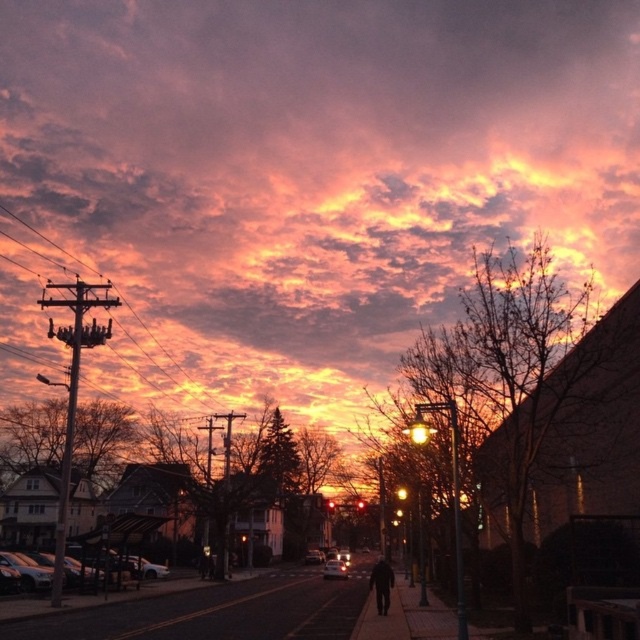
Can you confirm if dark asphalt road at lower center is smaller than shiny silver car at lower left?

Actually, dark asphalt road at lower center might be larger than shiny silver car at lower left.

Is point (205, 602) positioned in front of point (128, 570)?

Yes, it is in front of point (128, 570).

I want to click on dark asphalt road at lower center, so click(x=218, y=612).

Locate an element on the screen. dark asphalt road at lower center is located at coordinates (218, 612).

Does shiny silver car at lower left appear over black matte jacket at center?

No, shiny silver car at lower left is not above black matte jacket at center.

Can you confirm if shiny silver car at lower left is positioned to the right of black matte jacket at center?

In fact, shiny silver car at lower left is to the left of black matte jacket at center.

Is point (38, 564) in front of point (374, 570)?

No.

This screenshot has height=640, width=640. I want to click on shiny silver car at lower left, so click(x=28, y=568).

Which is more to the right, dark asphalt road at lower center or black matte jacket at center?

black matte jacket at center

Does point (52, 618) come farther from viewer compared to point (392, 570)?

No, it is not.

At what (x,y) coordinates should I click in order to perform the action: click on dark asphalt road at lower center. Please return your answer as a coordinate pair (x, y). This screenshot has width=640, height=640. Looking at the image, I should click on (218, 612).